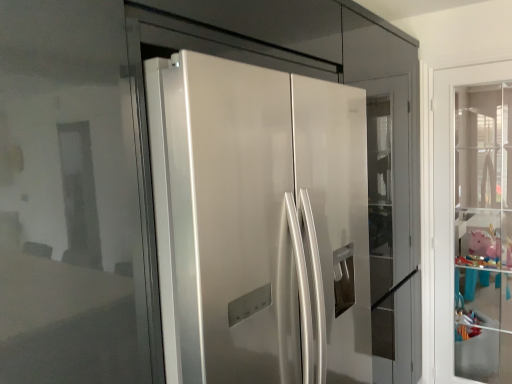
Question: Could clear glass door at right, which is counted as the first door, starting from the back, be considered to be inside pink matte piggy bank at right?

Choices:
 (A) no
 (B) yes

Answer: (A)

Question: Considering the relative positions of pink matte piggy bank at right and clear glass door at right, the 2th door in the front-to-back sequence, in the image provided, is pink matte piggy bank at right behind clear glass door at right, the 2th door in the front-to-back sequence,?

Choices:
 (A) yes
 (B) no

Answer: (A)

Question: Considering the relative sizes of pink matte piggy bank at right and clear glass door at right, which is the second door from left to right, in the image provided, is pink matte piggy bank at right shorter than clear glass door at right, which is the second door from left to right,?

Choices:
 (A) no
 (B) yes

Answer: (B)

Question: Can you confirm if pink matte piggy bank at right is smaller than clear glass door at right, which is counted as the first door, starting from the back?

Choices:
 (A) yes
 (B) no

Answer: (B)

Question: Is pink matte piggy bank at right outside of clear glass door at right, which is counted as the first door, starting from the back?

Choices:
 (A) yes
 (B) no

Answer: (A)

Question: From the image's perspective, is pink matte piggy bank at right on top of clear glass door at right, which is the second door from left to right?

Choices:
 (A) yes
 (B) no

Answer: (B)

Question: Considering the relative sizes of glossy white refrigerator at center, the 2th door viewed from the back, and clear glass door at right, the 1th door from the right, in the image provided, is glossy white refrigerator at center, the 2th door viewed from the back, smaller than clear glass door at right, the 1th door from the right,?

Choices:
 (A) yes
 (B) no

Answer: (B)

Question: Is glossy white refrigerator at center, which ranks as the 1th door in front-to-back order, to the right of clear glass door at right, the 1th door from the right, from the viewer's perspective?

Choices:
 (A) no
 (B) yes

Answer: (A)

Question: Does glossy white refrigerator at center, the 2th door viewed from the back, have a greater height compared to clear glass door at right, which is the second door from left to right?

Choices:
 (A) no
 (B) yes

Answer: (A)

Question: Is glossy white refrigerator at center, the 2th door viewed from the back, completely or partially outside of clear glass door at right, the 1th door from the right?

Choices:
 (A) no
 (B) yes

Answer: (B)

Question: Is the position of glossy white refrigerator at center, which appears as the 2th door when viewed from the right, more distant than that of clear glass door at right, which is the second door from left to right?

Choices:
 (A) no
 (B) yes

Answer: (A)

Question: Considering the relative sizes of glossy white refrigerator at center, which appears as the 2th door when viewed from the right, and clear glass door at right, the 1th door from the right, in the image provided, is glossy white refrigerator at center, which appears as the 2th door when viewed from the right, thinner than clear glass door at right, the 1th door from the right,?

Choices:
 (A) no
 (B) yes

Answer: (A)

Question: Is glossy white refrigerator at center, which ranks as the 1th door in front-to-back order, closer to the viewer compared to pink matte piggy bank at right?

Choices:
 (A) yes
 (B) no

Answer: (A)